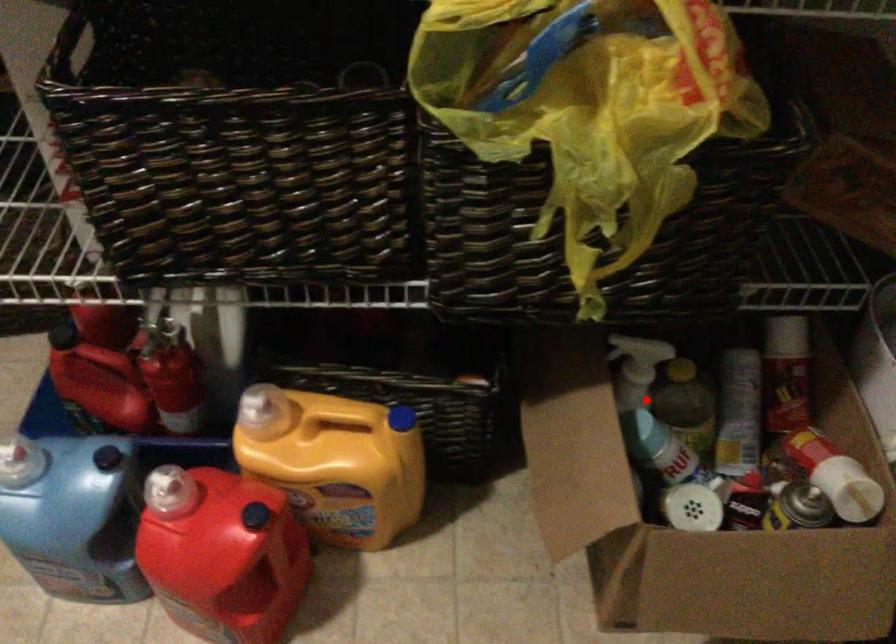
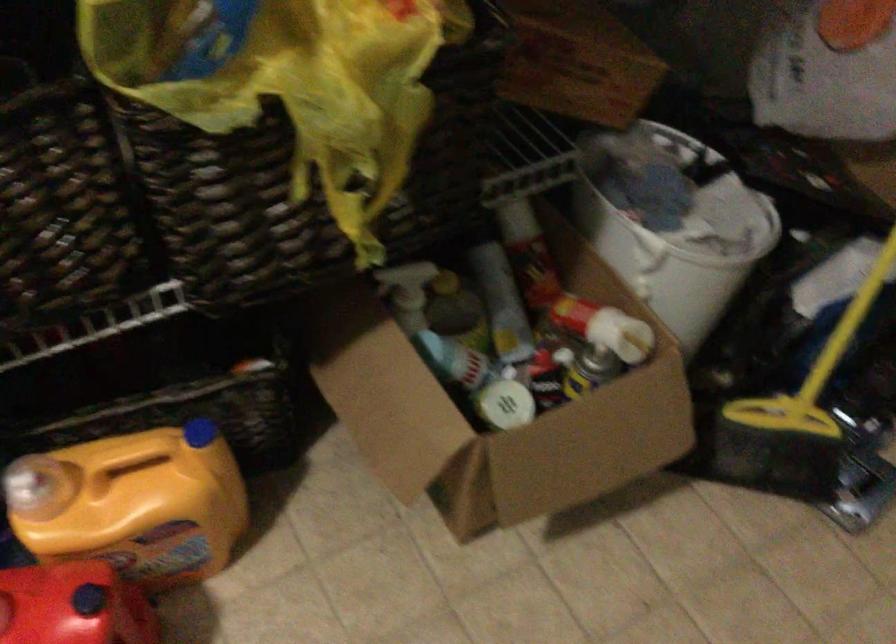
Where in the second image is the point corresponding to the highlighted location from the first image?

(426, 322)